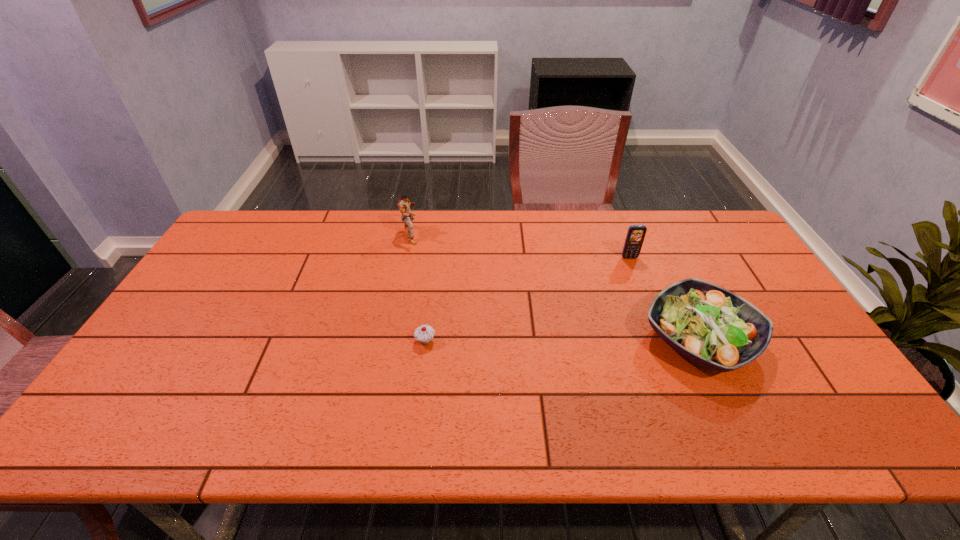
You are a GUI agent. You are given a task and a screenshot of the screen. Output one action in this format:
    pyautogui.click(x=<x>, y=<y>)
    Task: Click on the free spot that satisfies the following two spatial constraints: 1. on the screen of the salad plate; 2. on the left side of the cellular telephone
    The height and width of the screenshot is (540, 960).
    Given the screenshot: What is the action you would take?
    pyautogui.click(x=661, y=340)

Identify the location of vacant space that satisfies the following two spatial constraints: 1. on the front-facing side of the leftmost object; 2. on the right side of the cupcake. (390, 341).

The width and height of the screenshot is (960, 540). In order to click on free space that satisfies the following two spatial constraints: 1. on the screen of the third shortest object; 2. on the right side of the second shortest object in this screenshot , I will do `click(661, 340)`.

Where is `blank space that satisfies the following two spatial constraints: 1. on the front-facing side of the salad plate; 2. on the left side of the puncher`? The height and width of the screenshot is (540, 960). blank space that satisfies the following two spatial constraints: 1. on the front-facing side of the salad plate; 2. on the left side of the puncher is located at coordinates [x=390, y=340].

Identify the location of vacant region that satisfies the following two spatial constraints: 1. on the screen of the cellular telephone; 2. on the left side of the salad plate. (661, 340).

Identify the location of vacant space that satisfies the following two spatial constraints: 1. on the front-facing side of the third tallest object; 2. on the left side of the leftmost object. This screenshot has height=540, width=960. (390, 340).

I want to click on free spot that satisfies the following two spatial constraints: 1. on the front-facing side of the puncher; 2. on the left side of the salad plate, so click(390, 340).

At what (x,y) coordinates should I click in order to perform the action: click on vacant region that satisfies the following two spatial constraints: 1. on the screen of the third nearest object; 2. on the right side of the third tallest object. Please return your answer as a coordinate pair (x, y). This screenshot has width=960, height=540. Looking at the image, I should click on (661, 340).